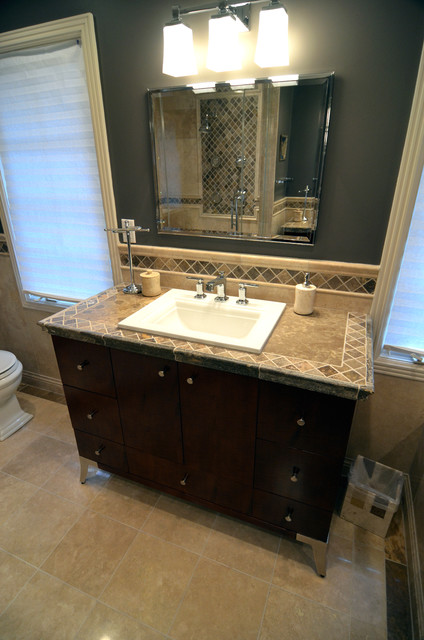
This screenshot has width=424, height=640. I want to click on floor, so click(122, 587).